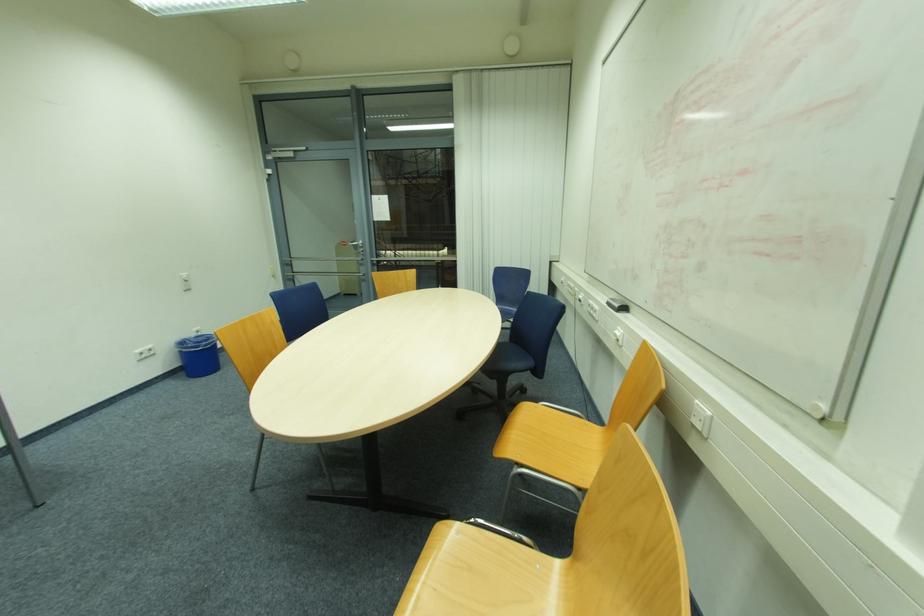
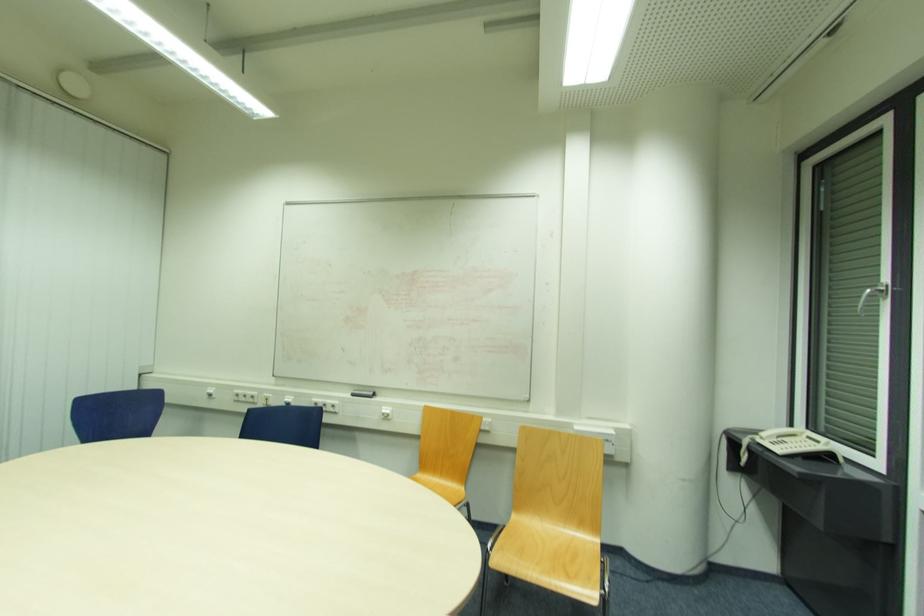
Question: I am providing you with two images of the same scene from different viewpoints. After the viewpoint changes to image2, which objects are now occluded?

Choices:
 (A) white wall switch
 (B) silver window handle
 (C) white telephone handset
 (D) none of these

Answer: (D)